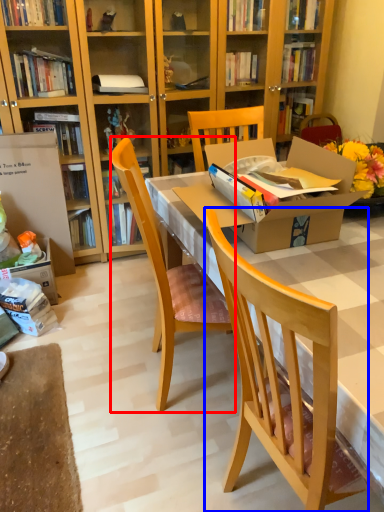
Question: Among these objects, which one is nearest to the camera, chair (highlighted by a red box) or chair (highlighted by a blue box)?

Choices:
 (A) chair
 (B) chair

Answer: (B)